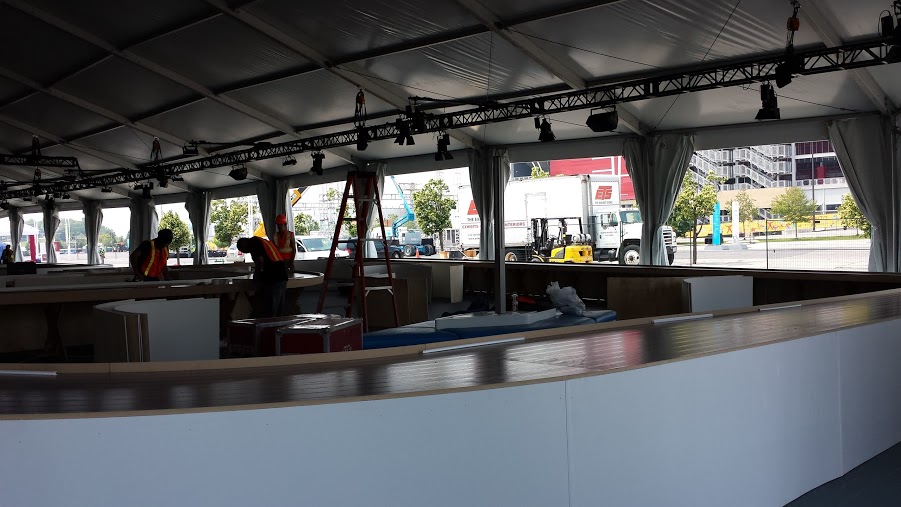
At what (x,y) coordinates should I click in order to perform the action: click on box. Please return your answer as a coordinate pair (x, y). The height and width of the screenshot is (507, 901). Looking at the image, I should click on (307, 348).